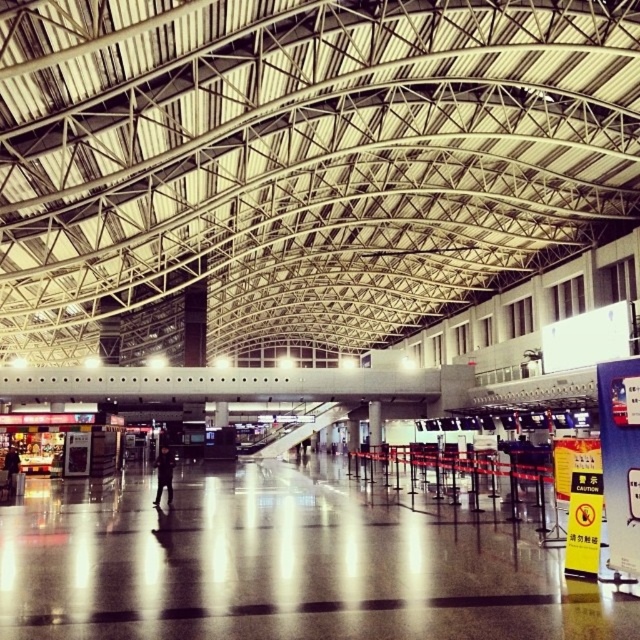
Is black matte person at center wider than dark gray suit at left?

Indeed, black matte person at center has a greater width compared to dark gray suit at left.

Can you confirm if black matte person at center is positioned to the right of dark gray suit at left?

Indeed, black matte person at center is positioned on the right side of dark gray suit at left.

Find the location of a particular element. The width and height of the screenshot is (640, 640). black matte person at center is located at coordinates (163, 474).